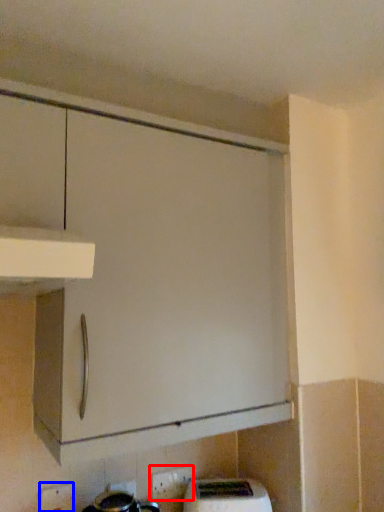
Question: Which object is further to the camera taking this photo, electric outlet (highlighted by a red box) or electric outlet (highlighted by a blue box)?

Choices:
 (A) electric outlet
 (B) electric outlet

Answer: (A)